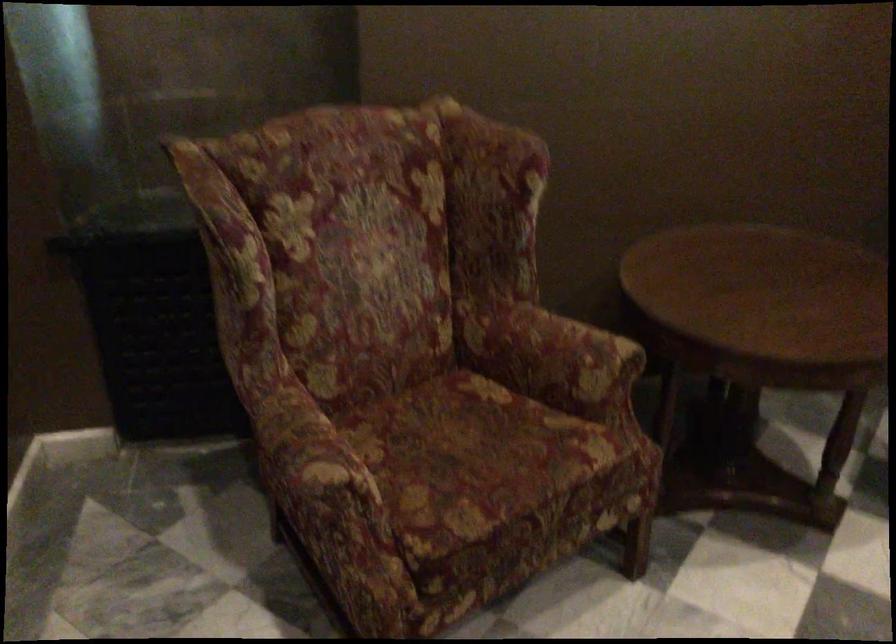
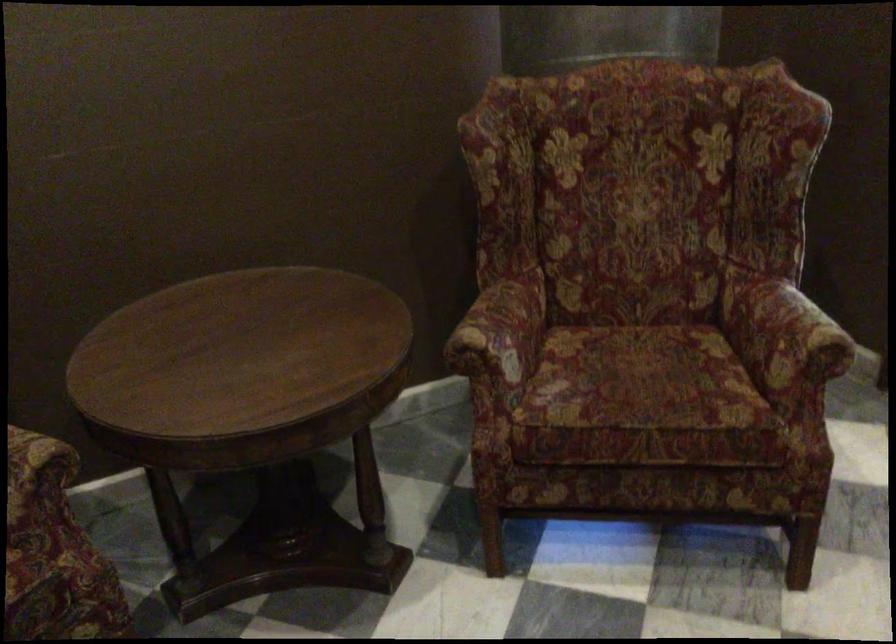
Question: In a continuous first-person perspective shot, in which direction is the camera moving?

Choices:
 (A) Left
 (B) Right
 (C) Forward
 (D) Backward

Answer: (B)